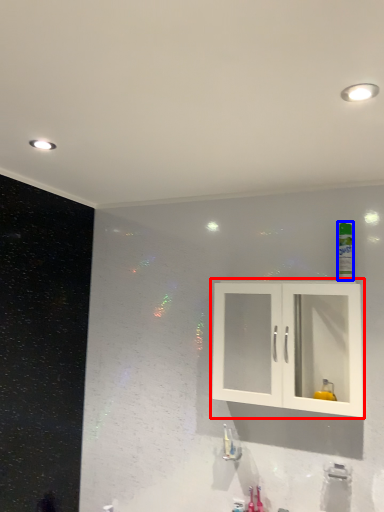
Question: Which object is further to the camera taking this photo, cabinetry (highlighted by a red box) or mouthwash (highlighted by a blue box)?

Choices:
 (A) cabinetry
 (B) mouthwash

Answer: (B)